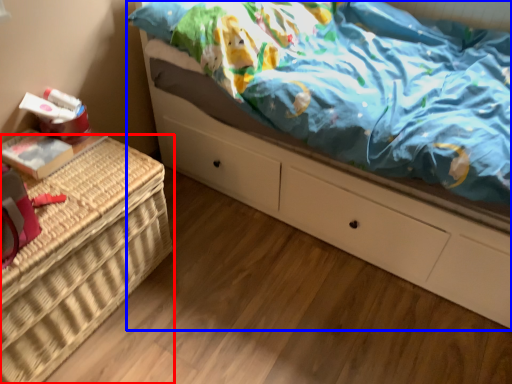
Question: Which object is closer to the camera taking this photo, furniture (highlighted by a red box) or bed (highlighted by a blue box)?

Choices:
 (A) furniture
 (B) bed

Answer: (B)